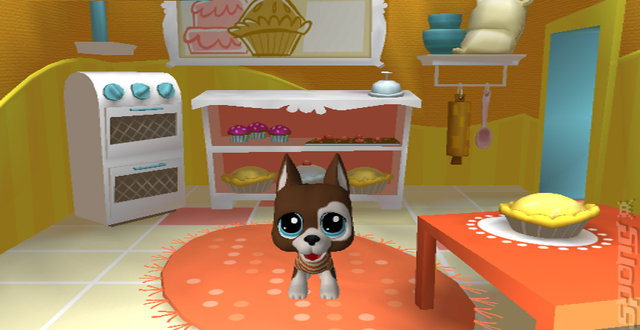
Image resolution: width=640 pixels, height=330 pixels. What are the coordinates of `spoon hanging up next to rolling pin` in the screenshot? It's located at (488, 101).